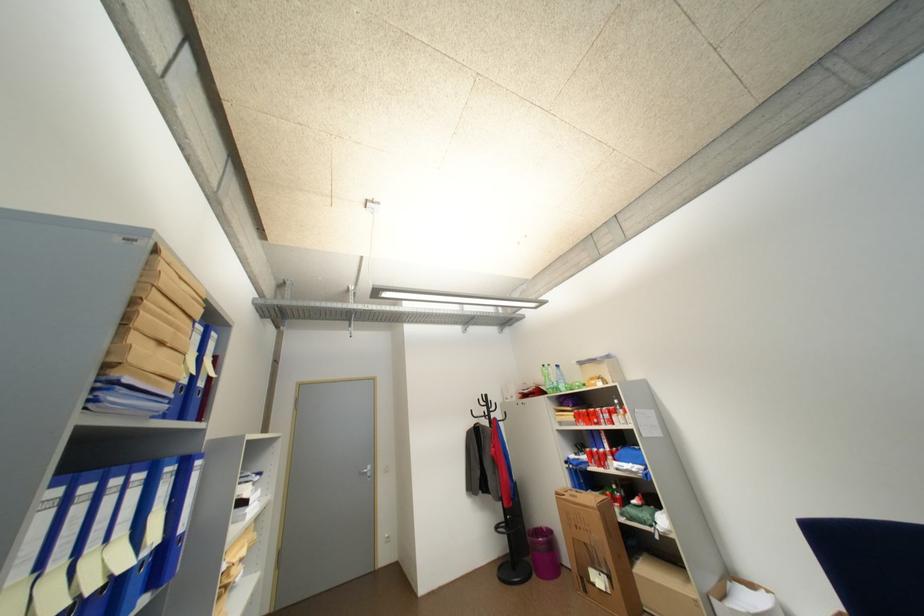
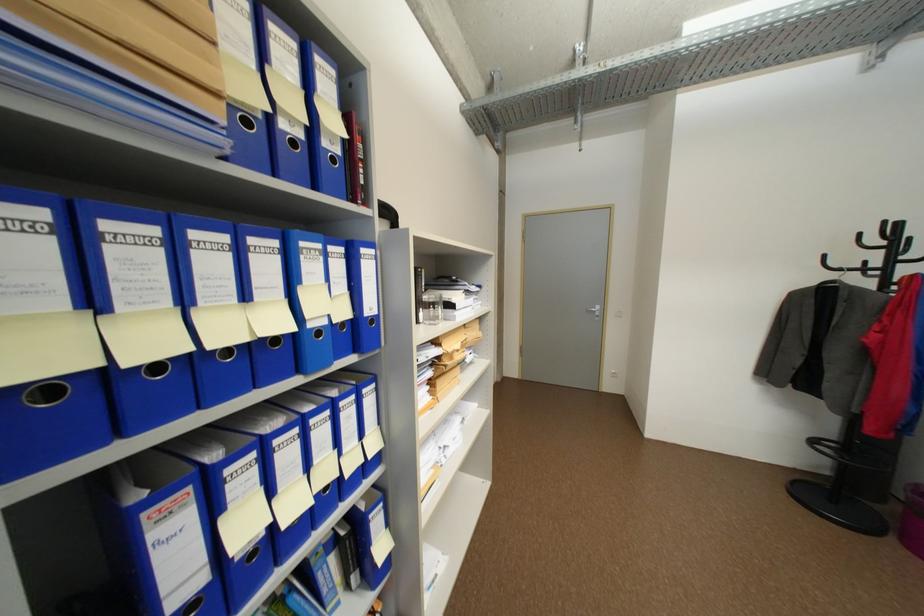
Find the pixel in the second image that matches point (492, 416) in the first image.

(873, 270)